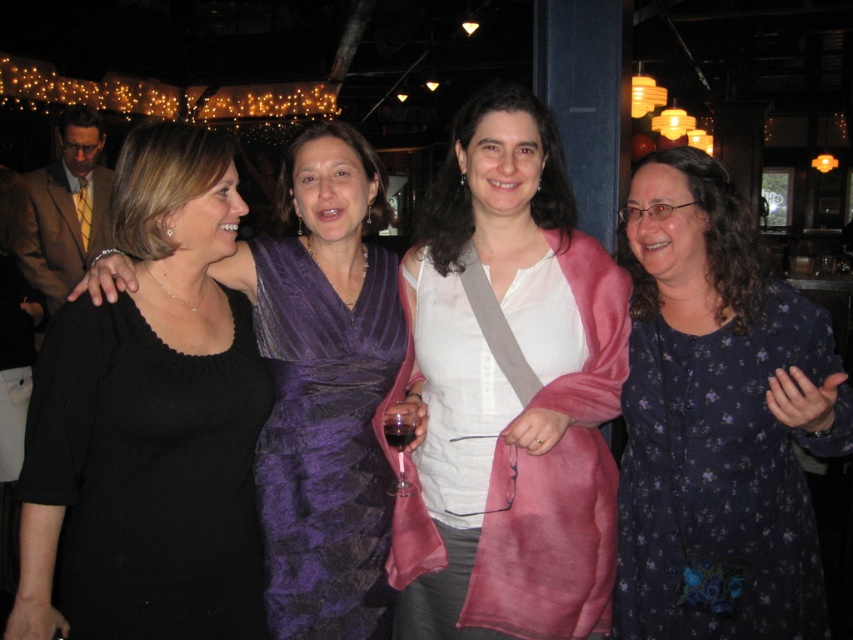
Question: Can you confirm if white silk scarf at center is positioned to the right of dark red glass at center?

Choices:
 (A) yes
 (B) no

Answer: (A)

Question: Which point is closer to the camera taking this photo?

Choices:
 (A) tap(236, 362)
 (B) tap(267, 436)
 (C) tap(396, 429)
 (D) tap(412, 413)

Answer: (C)

Question: Is white silk scarf at center above transparent glass at center?

Choices:
 (A) no
 (B) yes

Answer: (B)

Question: Considering the relative positions of black knitted dress at left and purple satin dress at center in the image provided, where is black knitted dress at left located with respect to purple satin dress at center?

Choices:
 (A) left
 (B) right

Answer: (A)

Question: Which point is closer to the camera?

Choices:
 (A) white silk scarf at center
 (B) dark blue floral dress at right
 (C) dark red glass at center

Answer: (B)

Question: Which of the following is the farthest from the observer?

Choices:
 (A) dark blue floral dress at right
 (B) white silk scarf at center

Answer: (B)